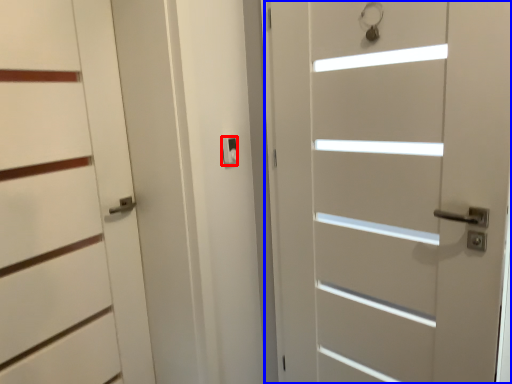
Question: Which object appears closest to the camera in this image, latch (highlighted by a red box) or door (highlighted by a blue box)?

Choices:
 (A) latch
 (B) door

Answer: (B)